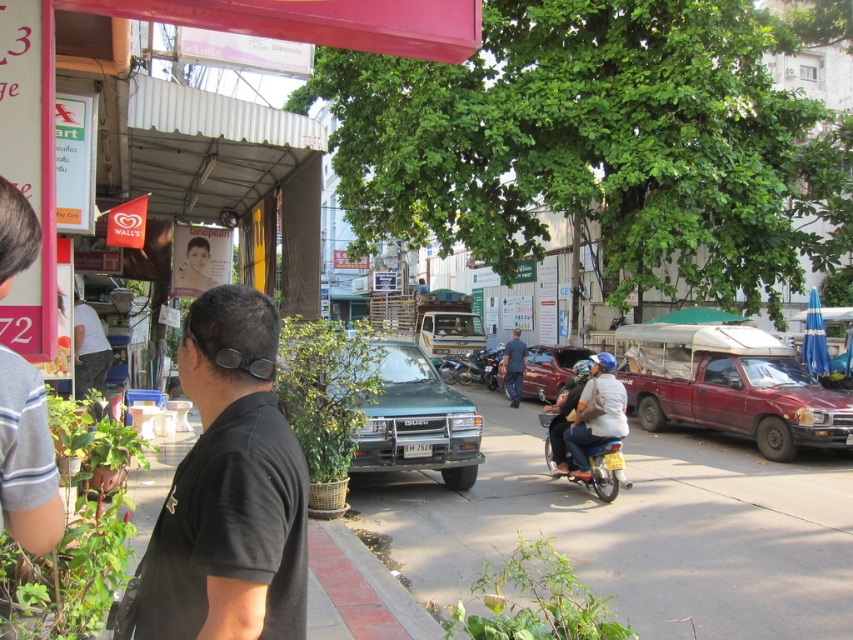
Question: Is green asphalt pavement at center smaller than metallic silver scooter at center?

Choices:
 (A) no
 (B) yes

Answer: (A)

Question: Does green asphalt pavement at center appear under metallic silver scooter at center?

Choices:
 (A) yes
 (B) no

Answer: (A)

Question: Among these objects, which one is nearest to the camera?

Choices:
 (A) green asphalt pavement at center
 (B) rusty metal pickup truck at center-right
 (C) metallic silver scooter at center
 (D) green matte truck at center

Answer: (A)

Question: Is black matte shirt at center wider than shiny maroon sedan at center?

Choices:
 (A) no
 (B) yes

Answer: (A)

Question: Which of the following is the farthest from the observer?

Choices:
 (A) blue uniform at center
 (B) green asphalt pavement at center
 (C) light blue fabric helmet at center

Answer: (A)

Question: Which point is closer to the camera?

Choices:
 (A) (285, 481)
 (B) (672, 417)

Answer: (A)